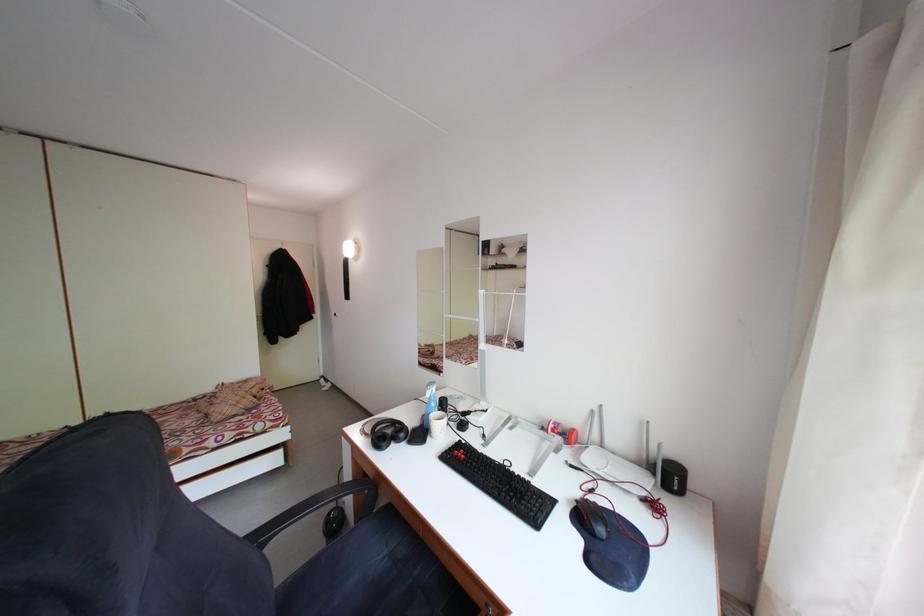
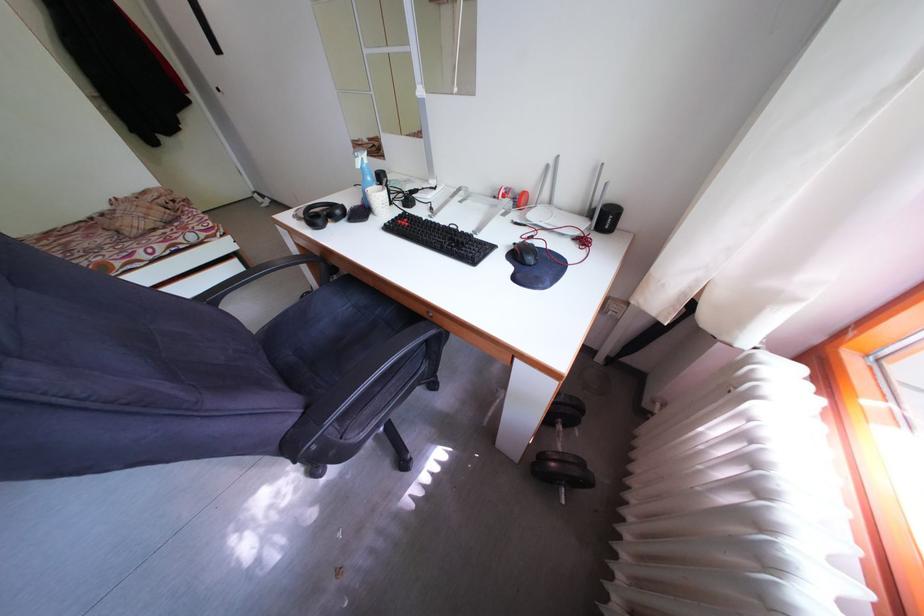
Where in the second image is the point corresponding to (441,411) from the first image?

(378, 185)